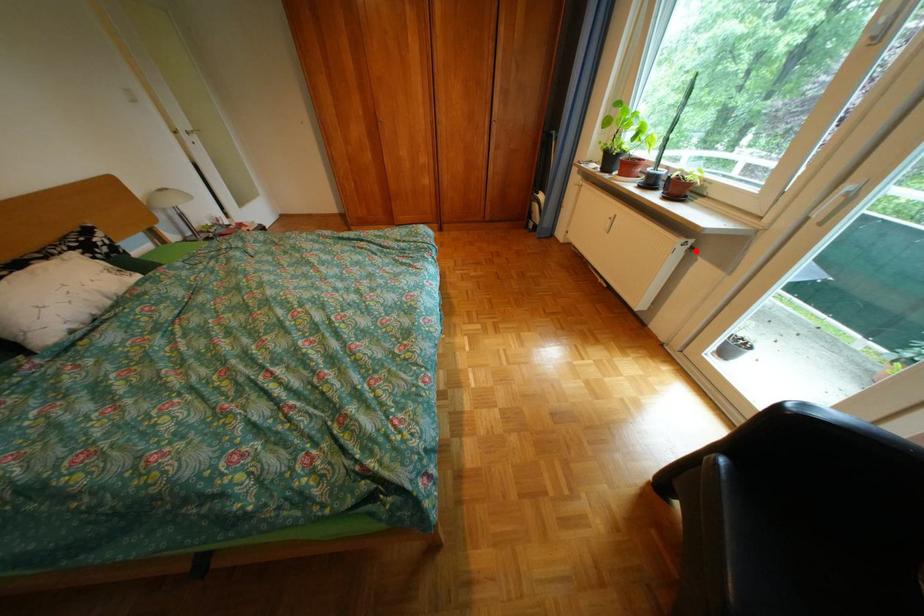
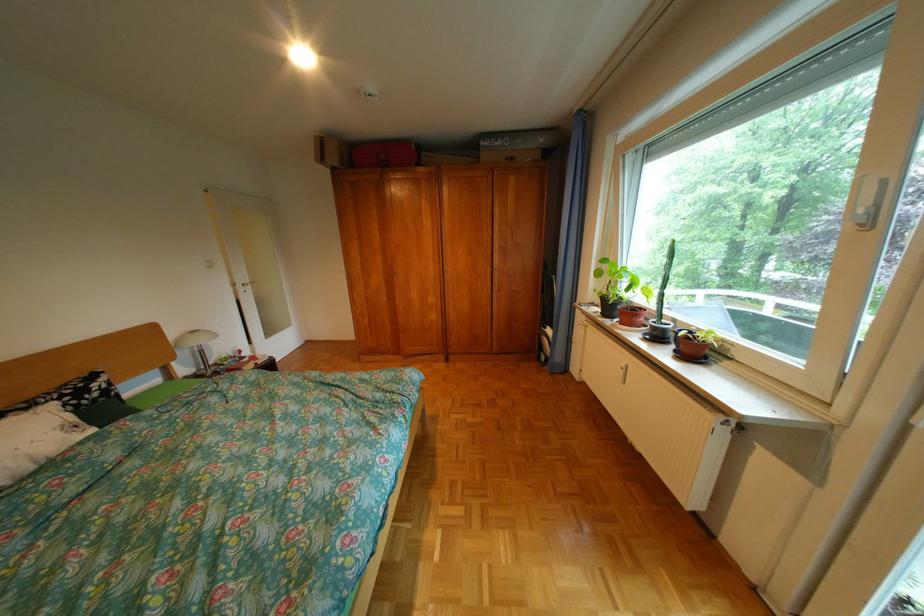
In the second image, find the point that corresponds to the highlighted location in the first image.

(738, 432)